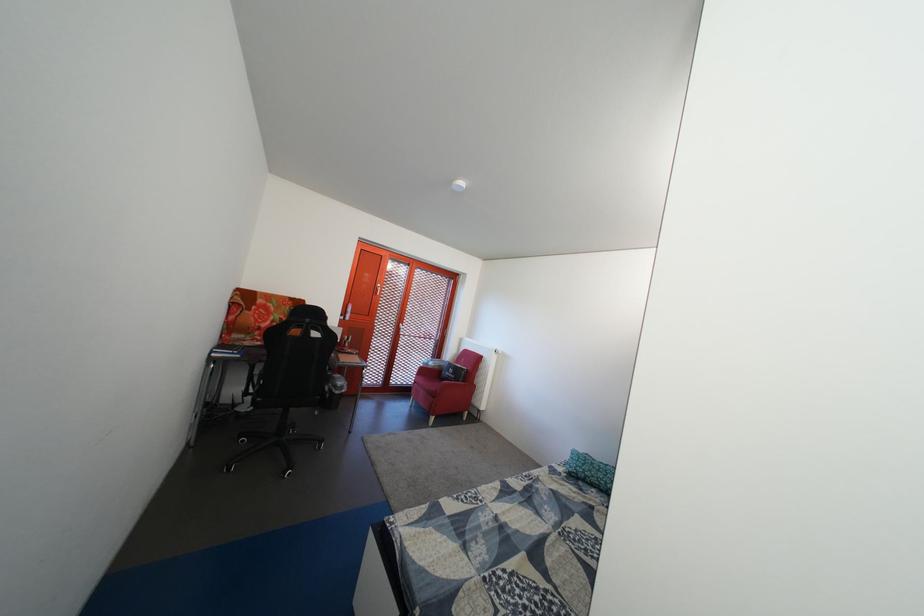
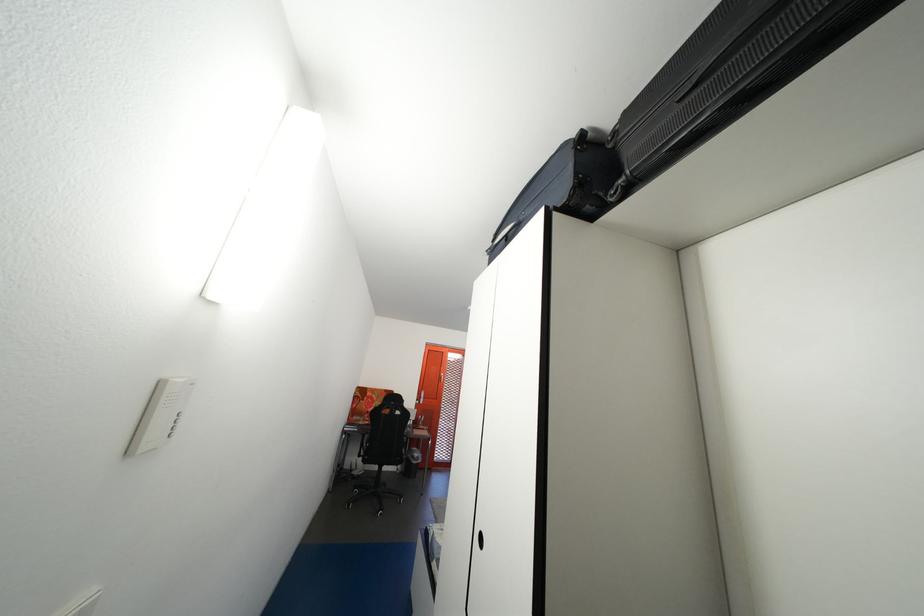
The point at (x=360, y=315) is marked in the first image. Where is the corresponding point in the second image?

(433, 402)